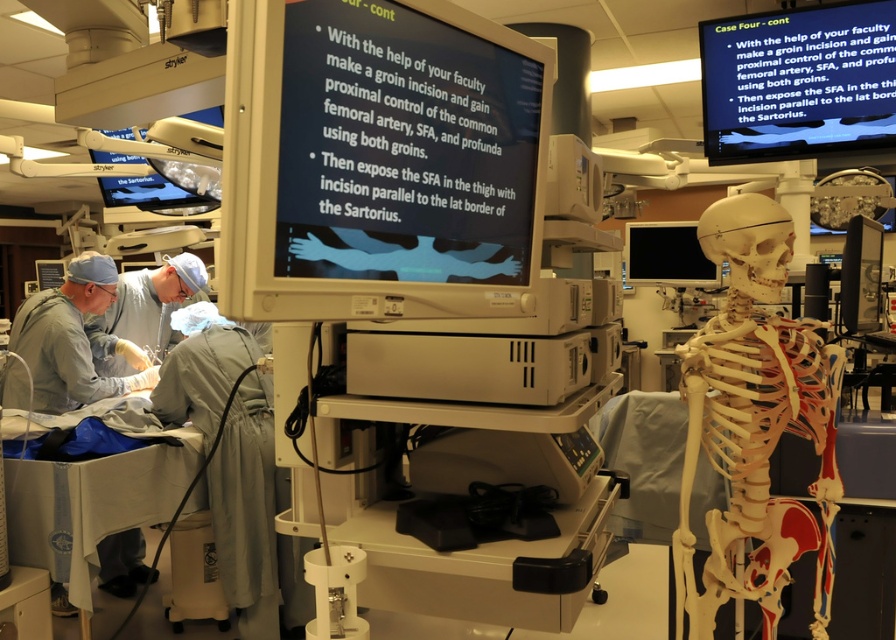
Question: Based on their relative distances, which object is nearer to the gray fabric at lower left?

Choices:
 (A) black glossy monitor at center
 (B) gray surgical gown at lower left
 (C) matte plastic monitor at center
 (D) gray matte surgical gown at left

Answer: (B)

Question: Can you confirm if gray fabric at lower left is positioned to the right of gray matte surgical gown at left?

Choices:
 (A) no
 (B) yes

Answer: (B)

Question: Is matte plastic monitor at center positioned before black glossy monitor at center?

Choices:
 (A) no
 (B) yes

Answer: (B)

Question: Which point is farther from the camera taking this photo?

Choices:
 (A) (885, 120)
 (B) (110, 330)

Answer: (B)

Question: Considering the relative positions of matte plastic monitor at center and black glossy monitor at center in the image provided, where is matte plastic monitor at center located with respect to black glossy monitor at center?

Choices:
 (A) below
 (B) above

Answer: (A)

Question: Which point is farther to the camera?

Choices:
 (A) (817, 67)
 (B) (265, 435)
 (C) (126, 348)

Answer: (C)